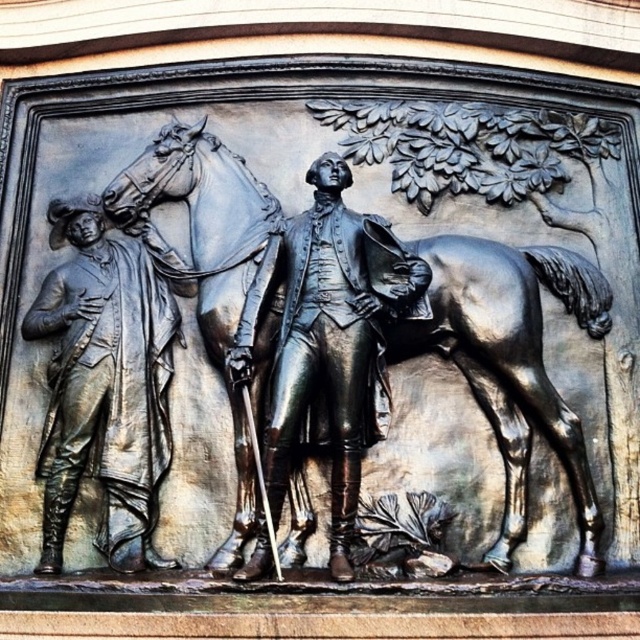
Question: Which point appears closest to the camera in this image?

Choices:
 (A) (141, 339)
 (B) (234, 376)
 (C) (228, 214)

Answer: (B)

Question: Estimate the real-world distances between objects in this image. Which object is farther from the shiny bronze statue at center?

Choices:
 (A) polished bronze horse at center
 (B) bronze figure at left

Answer: (B)

Question: Is bronze figure at left closer to camera compared to shiny bronze statue at center?

Choices:
 (A) no
 (B) yes

Answer: (A)

Question: Which object is farther from the camera taking this photo?

Choices:
 (A) polished bronze horse at center
 (B) bronze figure at left
 (C) shiny bronze statue at center

Answer: (B)

Question: Is bronze figure at left positioned before shiny bronze statue at center?

Choices:
 (A) no
 (B) yes

Answer: (A)

Question: Considering the relative positions of polished bronze horse at center and shiny bronze statue at center in the image provided, where is polished bronze horse at center located with respect to shiny bronze statue at center?

Choices:
 (A) left
 (B) right

Answer: (A)